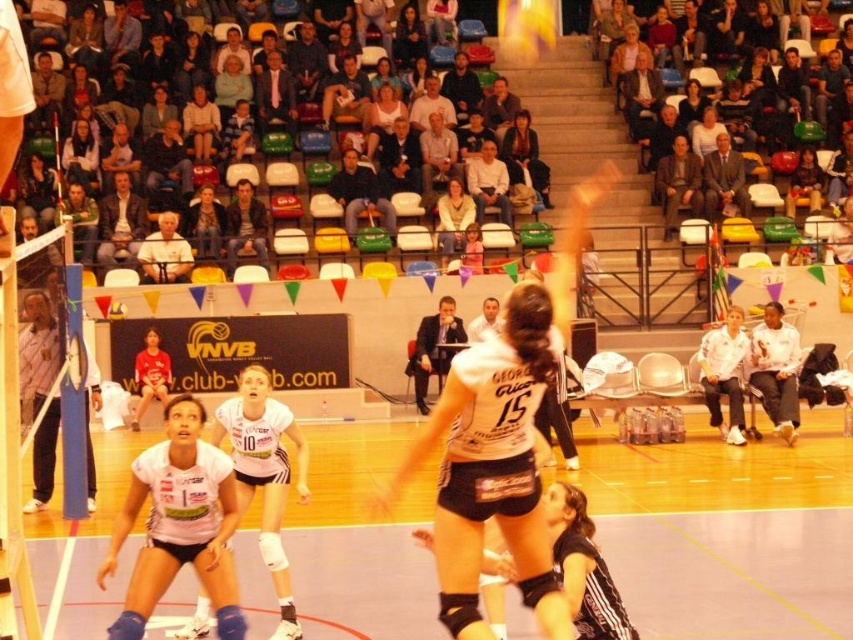
Is white matte volleyball player at center positioned behind smooth white blouse at upper center?

No, it is in front of smooth white blouse at upper center.

Which is above, white matte volleyball player at center or smooth white blouse at upper center?

smooth white blouse at upper center is higher up.

Identify the location of white matte volleyball player at center. The image size is (853, 640). tap(264, 474).

Measure the distance from white matte volleyball player at lower left to white matte volleyball player at center.

3.81 feet

Between point (167, 504) and point (276, 483), which one is positioned behind?

Point (276, 483)

Is point (239, 637) positioned behind point (270, 497)?

No, it is in front of (270, 497).

Find the location of a particular element. The width and height of the screenshot is (853, 640). white matte volleyball player at lower left is located at coordinates (178, 524).

Who is positioned more to the right, white matte jersey at center or matte white shirt at center?

Positioned to the right is white matte jersey at center.

Who is shorter, white matte jersey at center or matte white shirt at center?

Standing shorter between the two is matte white shirt at center.

This screenshot has height=640, width=853. Identify the location of white matte jersey at center. (502, 442).